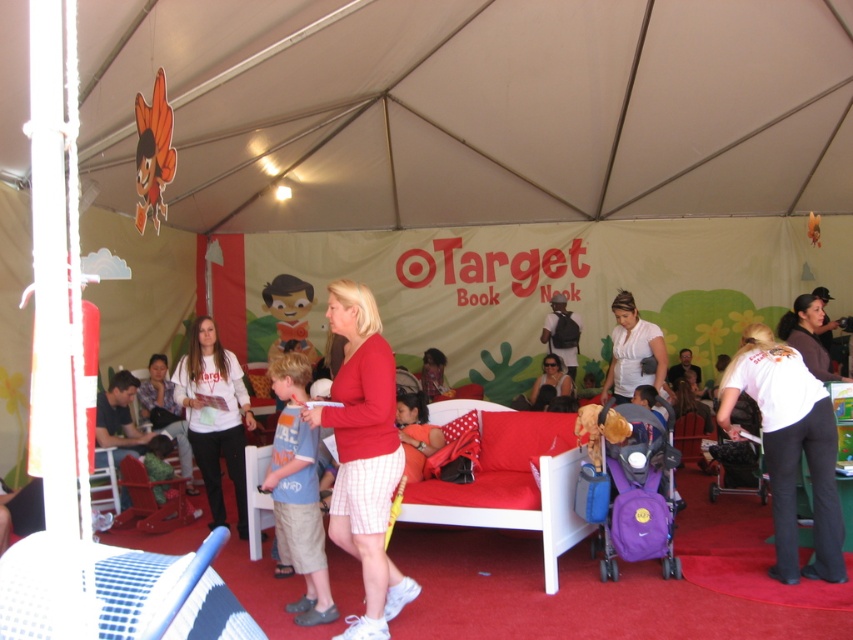
Question: Can you confirm if red matte shorts at center is positioned to the right of white matte shirt at center?

Choices:
 (A) no
 (B) yes

Answer: (A)

Question: Which object is positioned closest to the red matte shorts at center?

Choices:
 (A) white matte sweatshirt at center
 (B) white matte shirt at center

Answer: (A)

Question: Is white cotton shirt at lower right to the left of white matte sweatshirt at center from the viewer's perspective?

Choices:
 (A) no
 (B) yes

Answer: (A)

Question: Considering the real-world distances, which object is farthest from the white matte sweatshirt at center?

Choices:
 (A) matte plastic toy at center
 (B) brown fuzzy sweater at right

Answer: (A)

Question: Does red matte shorts at center appear on the right side of matte plastic toy at center?

Choices:
 (A) no
 (B) yes

Answer: (B)

Question: Which point is closer to the camera taking this photo?

Choices:
 (A) (384, 156)
 (B) (781, 545)

Answer: (B)